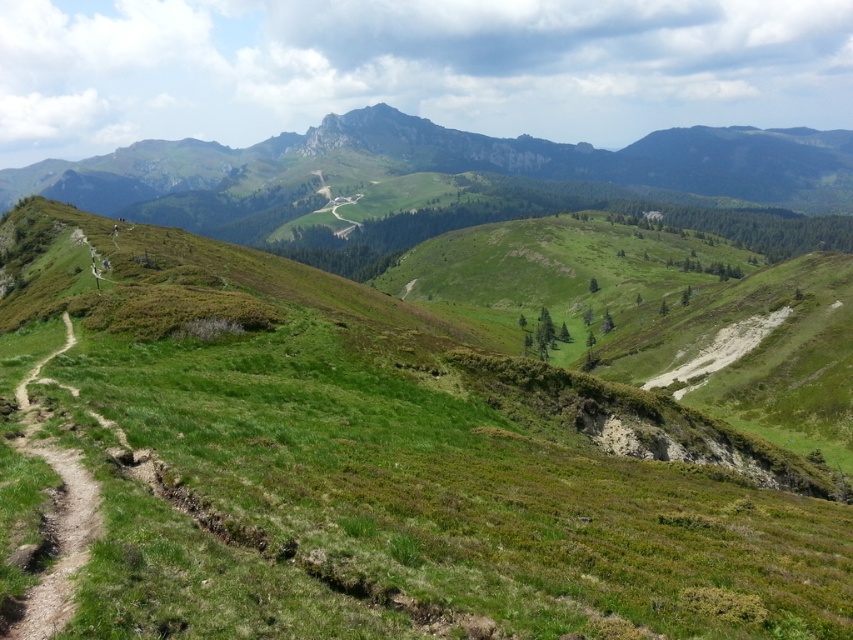
Question: Does green grassy at upper center have a greater width compared to dirt path at left?

Choices:
 (A) no
 (B) yes

Answer: (B)

Question: Which point is farther to the camera?

Choices:
 (A) (378, 129)
 (B) (225, 310)
 (C) (56, 464)

Answer: (A)

Question: Which of the following is the farthest from the observer?

Choices:
 (A) (766, 186)
 (B) (192, 426)
 (C) (48, 449)

Answer: (A)

Question: Is green grassy at upper center thinner than dirt path at left?

Choices:
 (A) no
 (B) yes

Answer: (A)

Question: Estimate the real-world distances between objects in this image. Which object is farther from the green grassy at upper center?

Choices:
 (A) dirt path at left
 (B) green grassy hill at upper center

Answer: (B)

Question: Does green grassy at upper center come in front of green grassy hill at upper center?

Choices:
 (A) no
 (B) yes

Answer: (B)